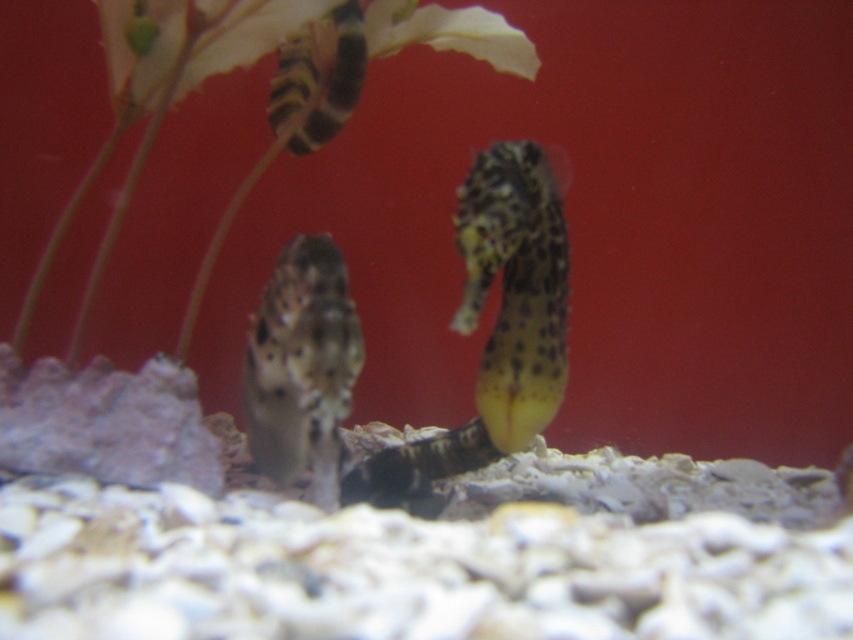
Based on the photo, you are a marine biologist observing the aquarium setup. You need to place a feeding tube that extends from your hand to the green leafy plant at upper center. If your hand is at 1 meter away from the plant, will the tube be long enough?

The green leafy plant at upper center is 1.26 meters away from the viewer. Since your hand is at 1 meter away from the plant, the tube needs to be at least 1.26 meters long to reach it. However, the hand is only 1 meter away, so the tube may not be long enough.

You are an underwater photographer trying to capture a closeup shot of the seahorses in the aquarium. You notice two points in the scene marked as point 1 at coordinates (242, 12) and point 2 at coordinates (410, 445). Which point should you focus on to ensure the seahorse closest to the camera is in sharp focus?

Point 1 at coordinates (242, 12) is closer to the camera than point 2 at coordinates (410, 445), so focusing on point 1 will ensure the seahorse closest to the camera is in sharp focus.